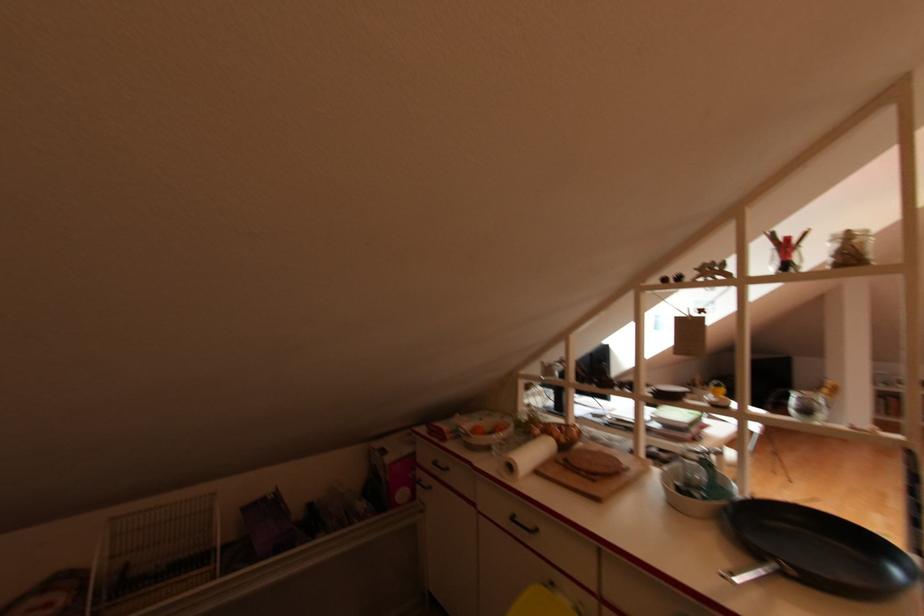
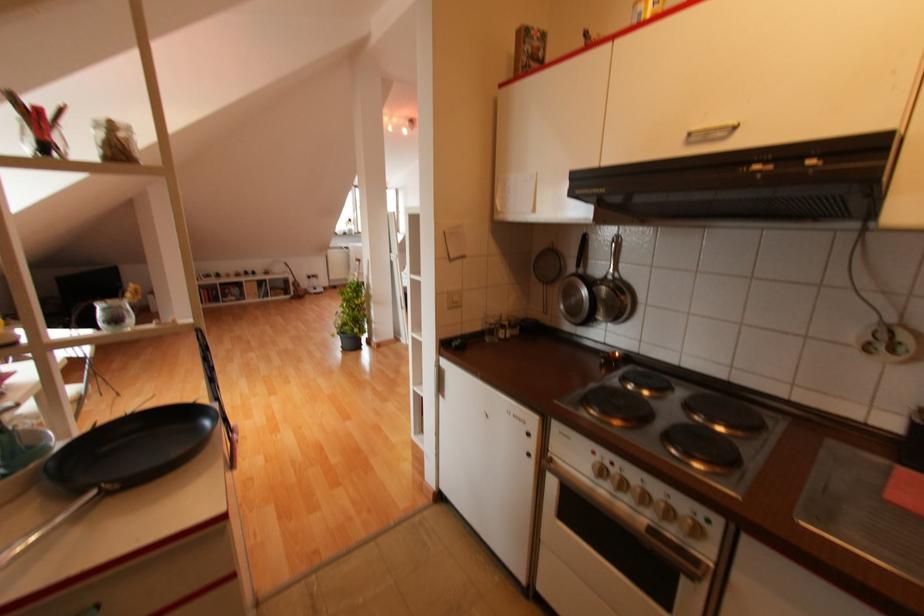
Question: The images are taken continuously from a first-person perspective. In which direction is your viewpoint rotating?

Choices:
 (A) Left
 (B) Right
 (C) Up
 (D) Down

Answer: (B)